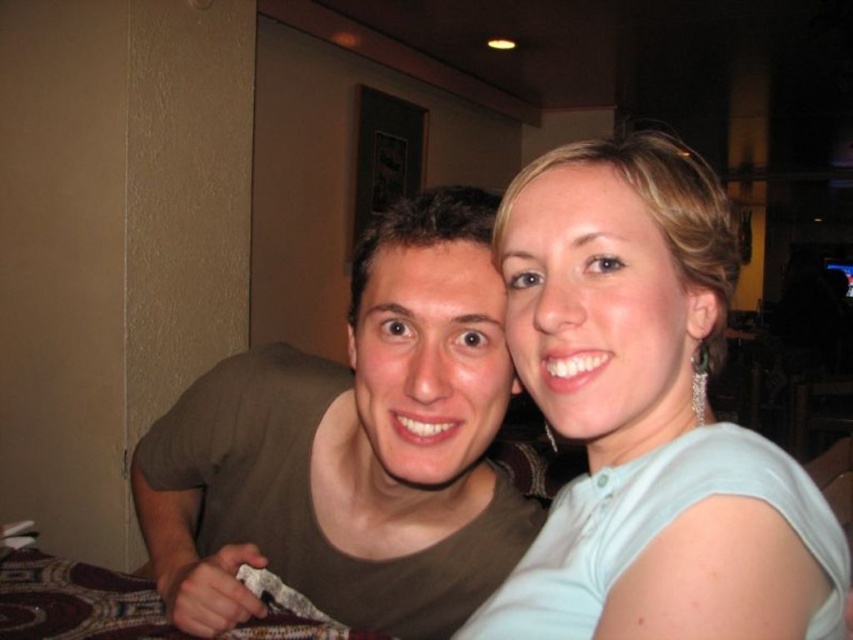
Question: Is light blue fabric at upper right to the left of matte brown shirt at center from the viewer's perspective?

Choices:
 (A) no
 (B) yes

Answer: (A)

Question: Is light blue fabric at upper right closer to the viewer compared to matte brown shirt at center?

Choices:
 (A) yes
 (B) no

Answer: (A)

Question: Among these points, which one is nearest to the camera?

Choices:
 (A) (448, 237)
 (B) (738, 464)

Answer: (B)

Question: Which object is closer to the camera taking this photo?

Choices:
 (A) matte brown shirt at center
 (B) light blue fabric at upper right

Answer: (B)

Question: Which of the following is the closest to the observer?

Choices:
 (A) matte brown shirt at center
 (B) light blue fabric at upper right

Answer: (B)

Question: Is light blue fabric at upper right smaller than matte brown shirt at center?

Choices:
 (A) no
 (B) yes

Answer: (B)